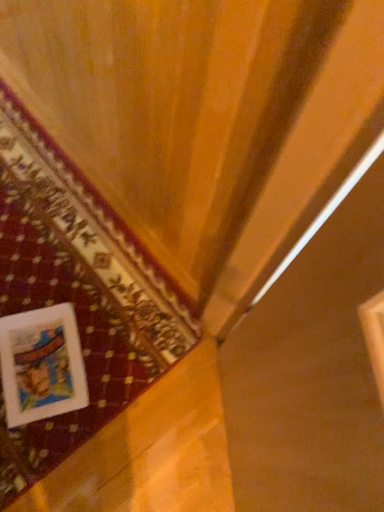
Where is `patterned carpet at lower left`? patterned carpet at lower left is located at coordinates (77, 293).

This screenshot has height=512, width=384. Describe the element at coordinates (77, 293) in the screenshot. I see `patterned carpet at lower left` at that location.

At what (x,y) coordinates should I click in order to perform the action: click on patterned carpet at lower left. Please return your answer as a coordinate pair (x, y). The height and width of the screenshot is (512, 384). Looking at the image, I should click on [x=77, y=293].